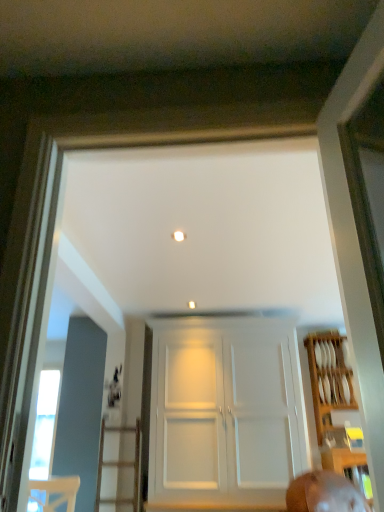
Question: Does wooden plate rack at right contain white matte door at center?

Choices:
 (A) no
 (B) yes

Answer: (A)

Question: Can you confirm if wooden plate rack at right is smaller than white matte door at center?

Choices:
 (A) no
 (B) yes

Answer: (B)

Question: Does wooden plate rack at right come behind white matte door at center?

Choices:
 (A) yes
 (B) no

Answer: (A)

Question: From a real-world perspective, is wooden plate rack at right positioned under white matte door at center based on gravity?

Choices:
 (A) yes
 (B) no

Answer: (B)

Question: Is wooden plate rack at right to the left of white matte door at center from the viewer's perspective?

Choices:
 (A) no
 (B) yes

Answer: (A)

Question: Can you confirm if wooden plate rack at right is positioned to the right of white matte door at center?

Choices:
 (A) no
 (B) yes

Answer: (B)

Question: From a real-world perspective, is white matte door at center beneath wooden plate rack at right?

Choices:
 (A) no
 (B) yes

Answer: (B)

Question: Is white matte door at center with wooden plate rack at right?

Choices:
 (A) no
 (B) yes

Answer: (A)

Question: Does white matte door at center have a greater height compared to wooden plate rack at right?

Choices:
 (A) yes
 (B) no

Answer: (A)

Question: Does white matte door at center have a larger size compared to wooden plate rack at right?

Choices:
 (A) no
 (B) yes

Answer: (B)

Question: Is white matte door at center positioned far away from wooden plate rack at right?

Choices:
 (A) yes
 (B) no

Answer: (B)

Question: Is white matte door at center positioned before wooden plate rack at right?

Choices:
 (A) no
 (B) yes

Answer: (B)

Question: Is wooden plate rack at right to the left or to the right of white matte door at center in the image?

Choices:
 (A) left
 (B) right

Answer: (B)